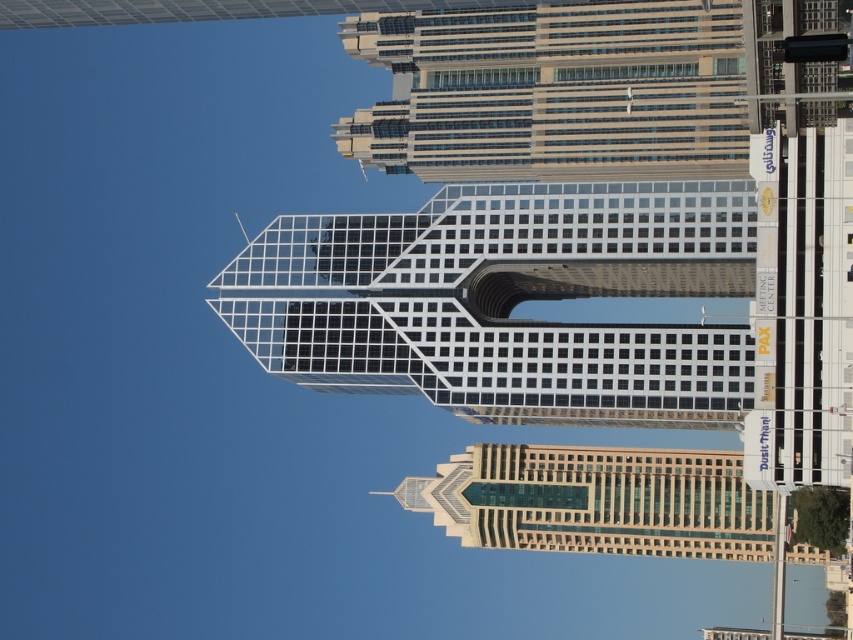
Question: Does transparent glass tower at center appear over glassy steel skyscraper at upper center?

Choices:
 (A) no
 (B) yes

Answer: (A)

Question: Among these points, which one is farthest from the camera?

Choices:
 (A) (480, 152)
 (B) (599, 424)

Answer: (A)

Question: Which point is closer to the camera?

Choices:
 (A) glassy steel skyscraper at upper center
 (B) transparent glass tower at center

Answer: (B)

Question: Which point is closer to the camera?

Choices:
 (A) glassy steel skyscraper at upper center
 (B) transparent glass tower at center

Answer: (B)

Question: Is transparent glass tower at center above glassy steel skyscraper at upper center?

Choices:
 (A) yes
 (B) no

Answer: (B)

Question: Can you confirm if transparent glass tower at center is positioned above glassy steel skyscraper at upper center?

Choices:
 (A) no
 (B) yes

Answer: (A)